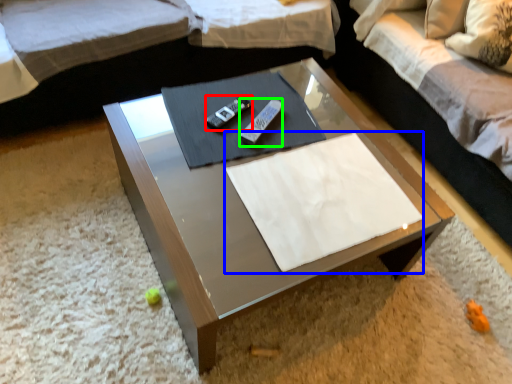
Question: Based on their relative distances, which object is nearer to remote (highlighted by a red box)? Choose from linen (highlighted by a blue box) and remote (highlighted by a green box).

Choices:
 (A) linen
 (B) remote

Answer: (B)